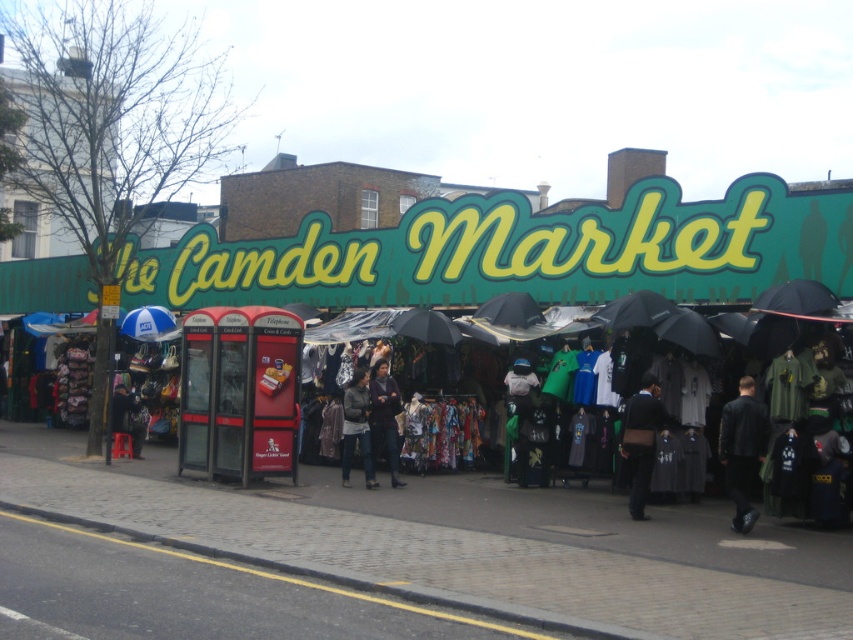
Looking at this image, is dark gray fabric jacket at center wider than blue glossy umbrella at center?

No.

Find the location of a particular element. The height and width of the screenshot is (640, 853). dark gray fabric jacket at center is located at coordinates (357, 428).

Which is above, dark brown leather jacket at center or blue glossy umbrella at center?

blue glossy umbrella at center

Can you confirm if dark brown leather jacket at center is shorter than blue glossy umbrella at center?

No, dark brown leather jacket at center is not shorter than blue glossy umbrella at center.

Does point (375, 420) come in front of point (129, 337)?

Yes, point (375, 420) is closer to viewer.

Locate an element on the screen. This screenshot has width=853, height=640. dark brown leather jacket at center is located at coordinates (384, 419).

Based on the photo, who is more forward, (102,497) or (753,442)?

Positioned in front is point (753,442).

Is brick pavement at lower center below black leather jacket at lower right?

Correct, brick pavement at lower center is located below black leather jacket at lower right.

In the scene shown: Measure the distance between brick pavement at lower center and camera.

A distance of 20.23 feet exists between brick pavement at lower center and camera.

Find the location of a particular element. brick pavement at lower center is located at coordinates (474, 540).